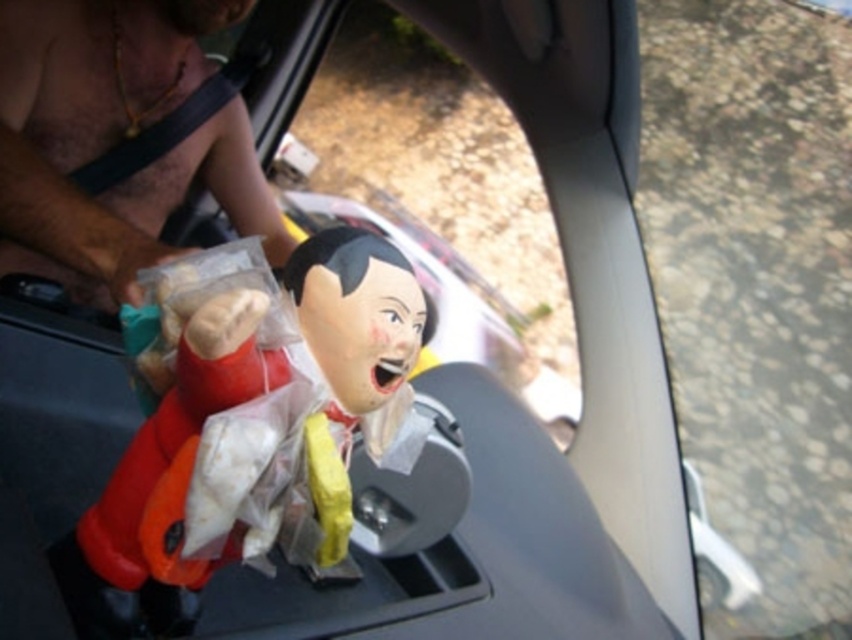
Between matte plastic doll at center and transparent plastic doll at center, which one has more height?

Standing taller between the two is transparent plastic doll at center.

Measure the distance between point (x=399, y=332) and camera.

Point (x=399, y=332) is 22.25 inches from camera.

Is point (372, 394) in front of point (488, 316)?

Yes.

Identify the location of matte plastic doll at center. This screenshot has height=640, width=852. (262, 410).

Which is behind, point (111, 577) or point (135, 33)?

Positioned behind is point (135, 33).

You are a GUI agent. You are given a task and a screenshot of the screen. Output one action in this format:
    pyautogui.click(x=<x>, y=<y>)
    Task: Click on the matte plastic doll at center
    
    Given the screenshot: What is the action you would take?
    pos(262,410)

Is point (494, 324) positioned after point (96, 77)?

Yes, it is.

I want to click on transparent plastic doll at center, so click(x=430, y=177).